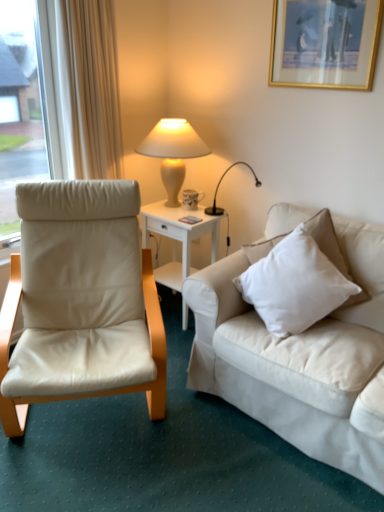
Measure the distance between point (183, 130) and camera.

7.97 feet.

What do you see at coordinates (192, 199) in the screenshot? The width and height of the screenshot is (384, 512). I see `porcelain floral mug at side table` at bounding box center [192, 199].

This screenshot has width=384, height=512. What do you see at coordinates (325, 44) in the screenshot?
I see `gold-framed picture at upper right` at bounding box center [325, 44].

Describe the element at coordinates (294, 285) in the screenshot. I see `white cotton pillow at right` at that location.

The width and height of the screenshot is (384, 512). I want to click on beige leather chair at left, so click(81, 300).

The width and height of the screenshot is (384, 512). In order to click on matte beige lamp at upper center in this screenshot , I will do `click(173, 152)`.

From the image's perspective, which is above, matte beige lamp at upper center or gold-framed picture at upper right?

From the image's view, gold-framed picture at upper right is above.

Is matte beige lamp at upper center taller than gold-framed picture at upper right?

Indeed, matte beige lamp at upper center has a greater height compared to gold-framed picture at upper right.

Does porcelain floral mug at side table have a lesser height compared to white glossy side table at center?

Yes.

From the image's perspective, is porcelain floral mug at side table above white glossy side table at center?

Yes, from the image's perspective, porcelain floral mug at side table is over white glossy side table at center.

From a real-world perspective, does porcelain floral mug at side table sit lower than white glossy side table at center?

No, from a real-world perspective, porcelain floral mug at side table is not under white glossy side table at center.

Does point (81, 190) come farther from viewer compared to point (190, 208)?

No, it is not.

From the picture: Does beige leather chair at left have a greater width compared to porcelain floral mug at side table?

Indeed, beige leather chair at left has a greater width compared to porcelain floral mug at side table.

In the scene shown: From a real-world perspective, who is located lower, beige leather chair at left or porcelain floral mug at side table?

beige leather chair at left, from a real-world perspective.

At what (x,y) coordinates should I click in order to perform the action: click on coffee cup below the matte beige lamp at upper center (from a real-world perspective). Please return your answer as a coordinate pair (x, y). This screenshot has height=512, width=384. Looking at the image, I should click on (192, 199).

Is porcelain floral mug at side table aimed at matte beige lamp at upper center?

Yes, porcelain floral mug at side table is turned towards matte beige lamp at upper center.

In the image, is porcelain floral mug at side table positioned in front of or behind matte beige lamp at upper center?

In the image, porcelain floral mug at side table appears behind matte beige lamp at upper center.

Based on the photo, considering the sizes of objects gold-framed picture at upper right and matte beige lamp at upper center in the image provided, who is wider, gold-framed picture at upper right or matte beige lamp at upper center?

Wider between the two is matte beige lamp at upper center.

Is point (338, 57) in front of point (170, 187)?

Yes, point (338, 57) is closer to viewer.

The width and height of the screenshot is (384, 512). I want to click on lamp that appears below the gold-framed picture at upper right (from the image's perspective), so click(173, 152).

Which is correct: gold-framed picture at upper right is inside matte beige lamp at upper center, or outside of it?

gold-framed picture at upper right is spatially situated outside matte beige lamp at upper center.

Is point (369, 81) more distant than point (208, 216)?

No, (369, 81) is closer to viewer.

Are gold-framed picture at upper right and white glossy side table at center far apart?

Yes, gold-framed picture at upper right and white glossy side table at center are located far from each other.

Choose the correct answer: Is gold-framed picture at upper right inside white glossy side table at center or outside it?

gold-framed picture at upper right is not enclosed by white glossy side table at center.

Based on the photo, measure the distance from gold-framed picture at upper right to white glossy side table at center.

gold-framed picture at upper right is 1.06 meters away from white glossy side table at center.

Find the location of a particular element. The height and width of the screenshot is (512, 384). pillow above the white glossy side table at center (from a real-world perspective) is located at coordinates (294, 285).

From the image's perspective, is white cotton pillow at right below white glossy side table at center?

Correct, white cotton pillow at right appears lower than white glossy side table at center in the image.

Looking at their sizes, would you say white cotton pillow at right is wider or thinner than white glossy side table at center?

Considering their sizes, white cotton pillow at right looks broader than white glossy side table at center.

Which object is positioned more to the right, white cotton pillow at right or white glossy side table at center?

white cotton pillow at right is more to the right.

Identify the location of picture frame in front of the matte beige lamp at upper center. This screenshot has width=384, height=512. (325, 44).

In order to click on desk below the porcelain floral mug at side table (from a real-world perspective) in this screenshot , I will do `click(178, 238)`.

Based on their spatial positions, is white glossy side table at center or gold-framed picture at upper right further from beige leather chair at left?

gold-framed picture at upper right lies further to beige leather chair at left than the other object.

Which object lies nearer to the anchor point beige leather chair at left, white glossy side table at center or white cotton pillow at right?

white glossy side table at center is closer to beige leather chair at left.

Looking at the image, which one is located further to white glossy side table at center, beige leather chair at left or matte beige lamp at upper center?

beige leather chair at left.

Estimate the real-world distances between objects in this image. Which object is further from white cotton pillow at right, porcelain floral mug at side table or white glossy side table at center?

porcelain floral mug at side table.

Considering their positions, is gold-framed picture at upper right positioned further to white glossy side table at center than beige leather chair at left?

Among the two, gold-framed picture at upper right is located further to white glossy side table at center.

Estimate the real-world distances between objects in this image. Which object is closer to matte beige lamp at upper center, white glossy side table at center or beige leather chair at left?

white glossy side table at center is closer to matte beige lamp at upper center.

From the picture: Which object lies nearer to the anchor point porcelain floral mug at side table, white glossy side table at center or white cotton pillow at right?

Based on the image, white glossy side table at center appears to be nearer to porcelain floral mug at side table.

When comparing their distances from matte beige lamp at upper center, does white cotton pillow at right or white glossy side table at center seem further?

white cotton pillow at right is positioned further to the anchor matte beige lamp at upper center.

Find the location of a particular element. coffee cup between gold-framed picture at upper right and white glossy side table at center in the up-down direction is located at coordinates (192, 199).

Identify the location of coffee cup between gold-framed picture at upper right and white cotton pillow at right from top to bottom. (192, 199).

You are a GUI agent. You are given a task and a screenshot of the screen. Output one action in this format:
    pyautogui.click(x=<x>, y=<y>)
    Task: Click on the pillow between beige leather chair at left and porcelain floral mug at side table in the front-back direction
    
    Given the screenshot: What is the action you would take?
    pyautogui.click(x=294, y=285)

The image size is (384, 512). In order to click on desk between gold-framed picture at upper right and beige leather chair at left from top to bottom in this screenshot , I will do `click(178, 238)`.